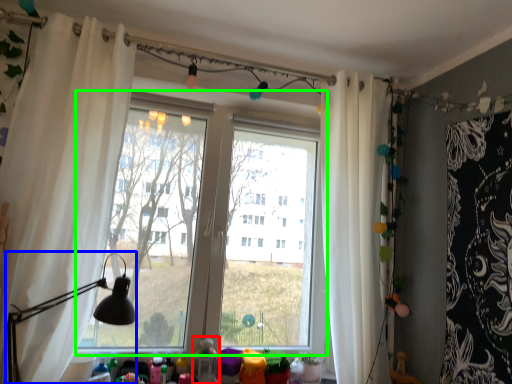
Question: Based on their relative distances, which object is nearer to toy (highlighted by a red box)? Choose from table lamp (highlighted by a blue box) and window (highlighted by a green box).

Choices:
 (A) table lamp
 (B) window

Answer: (A)